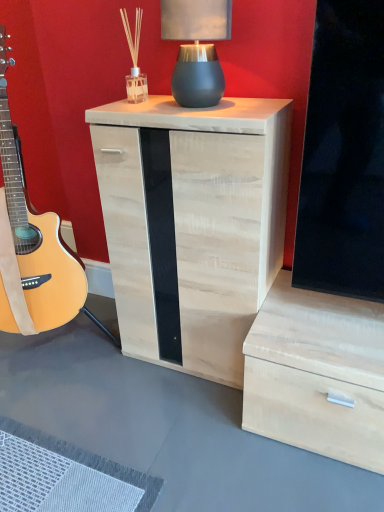
Locate an element on the screen. Image resolution: width=384 pixels, height=512 pixels. empty space that is ontop of light wood/texture nightstand at center (from a real-world perspective) is located at coordinates (189, 103).